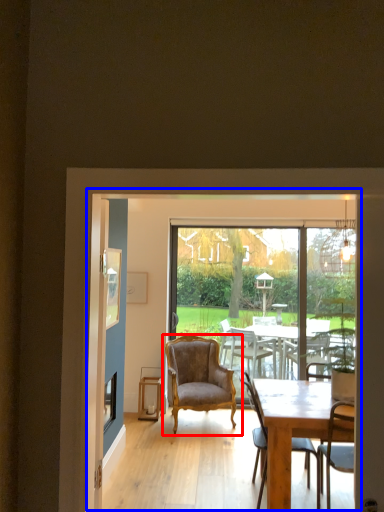
Question: Among these objects, which one is nearest to the camera, chair (highlighted by a red box) or screen door (highlighted by a blue box)?

Choices:
 (A) chair
 (B) screen door

Answer: (B)